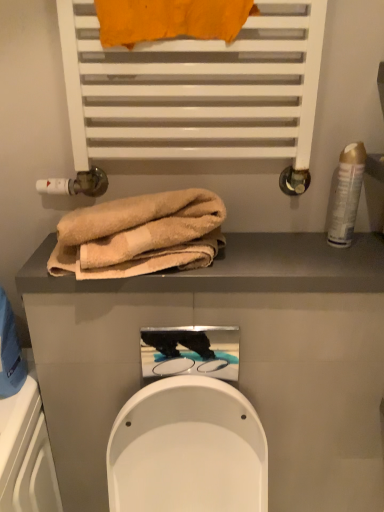
Find the location of a particular element. free spot above beige towel at upper center (from a real-world perspective) is located at coordinates (274, 255).